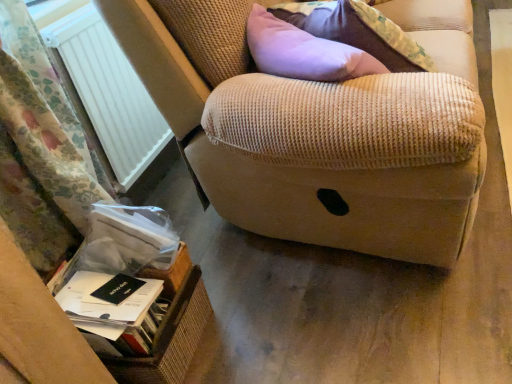
Question: Can you confirm if black matte paperback book at lower left, the second paperback book positioned from the bottom, is bigger than brown wicker basket at lower left?

Choices:
 (A) yes
 (B) no

Answer: (B)

Question: Does black matte paperback book at lower left, the second paperback book positioned from the bottom, have a smaller size compared to brown wicker basket at lower left?

Choices:
 (A) no
 (B) yes

Answer: (B)

Question: Is black matte paperback book at lower left, the second paperback book positioned from the bottom, thinner than brown wicker basket at lower left?

Choices:
 (A) no
 (B) yes

Answer: (B)

Question: Is black matte paperback book at lower left, the second paperback book positioned from the bottom, not close to brown wicker basket at lower left?

Choices:
 (A) no
 (B) yes

Answer: (A)

Question: Is black matte paperback book at lower left, the second paperback book positioned from the bottom, outside of brown wicker basket at lower left?

Choices:
 (A) yes
 (B) no

Answer: (A)

Question: Can you confirm if black matte paperback book at lower left, the 1th paperback book viewed from the top, is taller than brown wicker basket at lower left?

Choices:
 (A) yes
 (B) no

Answer: (B)

Question: Can you confirm if brown wicker basket at lower left is positioned to the left of white paper at lower left, the second paperback book from the top?

Choices:
 (A) no
 (B) yes

Answer: (A)

Question: Does brown wicker basket at lower left have a lesser width compared to white paper at lower left, which appears as the first paperback book when ordered from the bottom?

Choices:
 (A) no
 (B) yes

Answer: (A)

Question: Is brown wicker basket at lower left facing towards white paper at lower left, which appears as the first paperback book when ordered from the bottom?

Choices:
 (A) no
 (B) yes

Answer: (A)

Question: Does brown wicker basket at lower left have a greater width compared to white paper at lower left, which appears as the first paperback book when ordered from the bottom?

Choices:
 (A) no
 (B) yes

Answer: (B)

Question: Considering the relative sizes of brown wicker basket at lower left and white paper at lower left, which appears as the first paperback book when ordered from the bottom, in the image provided, is brown wicker basket at lower left bigger than white paper at lower left, which appears as the first paperback book when ordered from the bottom,?

Choices:
 (A) no
 (B) yes

Answer: (B)

Question: From a real-world perspective, is brown wicker basket at lower left positioned over white paper at lower left, the second paperback book from the top, based on gravity?

Choices:
 (A) no
 (B) yes

Answer: (A)

Question: Can you confirm if floral fabric curtain at left is thinner than white plastic radiator at left?

Choices:
 (A) yes
 (B) no

Answer: (B)